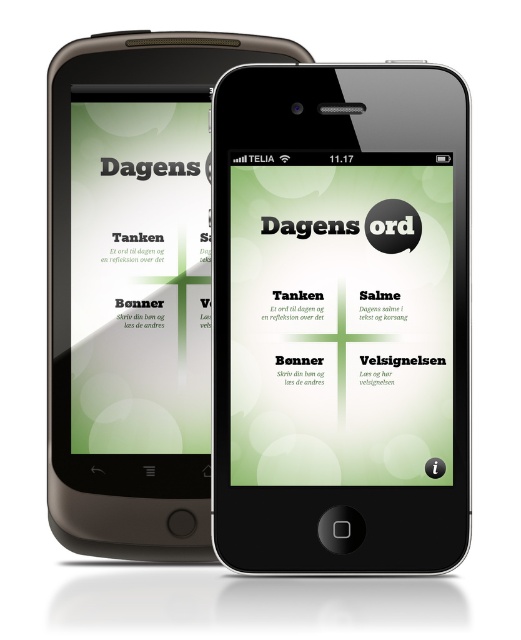
Question: Is matte black smartphone at center in front of matte green paper at left?

Choices:
 (A) no
 (B) yes

Answer: (B)

Question: Which object is the closest to the matte black smartphone at left?

Choices:
 (A) matte green paper at left
 (B) matte black smartphone at center

Answer: (A)

Question: Is matte black smartphone at center to the right of matte black smartphone at left from the viewer's perspective?

Choices:
 (A) no
 (B) yes

Answer: (B)

Question: Which of these objects is positioned farthest from the matte black smartphone at left?

Choices:
 (A) matte green paper at left
 (B) matte black smartphone at center

Answer: (B)

Question: Can you confirm if matte black smartphone at left is positioned to the left of matte green paper at left?

Choices:
 (A) no
 (B) yes

Answer: (A)

Question: Which of the following is the farthest from the observer?

Choices:
 (A) matte black smartphone at left
 (B) matte black smartphone at center

Answer: (A)